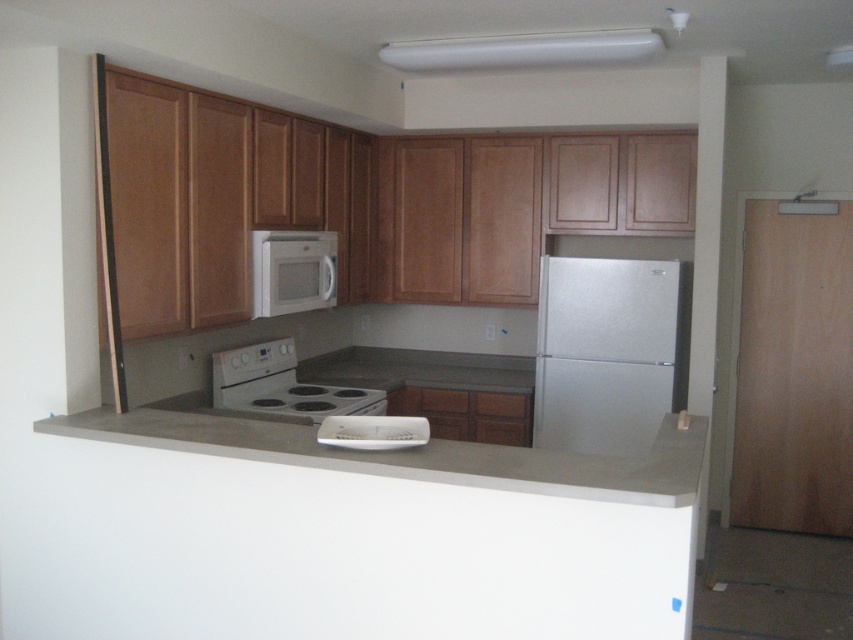
Is white matte microwave at center smaller than white matte toaster at center?

Incorrect, white matte microwave at center is not smaller in size than white matte toaster at center.

Can you confirm if white matte microwave at center is shorter than white matte toaster at center?

Incorrect, white matte microwave at center's height does not fall short of white matte toaster at center's.

At what (x,y) coordinates should I click in order to perform the action: click on white matte microwave at center. Please return your answer as a coordinate pair (x, y). The image size is (853, 640). Looking at the image, I should click on (292, 269).

Does concrete at center have a lesser width compared to white matte microwave at center?

No.

Is concrete at center closer to the viewer compared to white matte microwave at center?

That is True.

You are a GUI agent. You are given a task and a screenshot of the screen. Output one action in this format:
    pyautogui.click(x=<x>, y=<y>)
    Task: Click on the concrete at center
    
    Given the screenshot: What is the action you would take?
    pyautogui.click(x=410, y=452)

Image resolution: width=853 pixels, height=640 pixels. Identify the location of concrete at center. (410, 452).

Is silver metallic refrigerator at right thinner than concrete at center?

Yes.

Does point (631, 352) come farther from viewer compared to point (669, 474)?

That is True.

The image size is (853, 640). What do you see at coordinates (605, 353) in the screenshot?
I see `silver metallic refrigerator at right` at bounding box center [605, 353].

Locate an element on the screen. The height and width of the screenshot is (640, 853). silver metallic refrigerator at right is located at coordinates (605, 353).